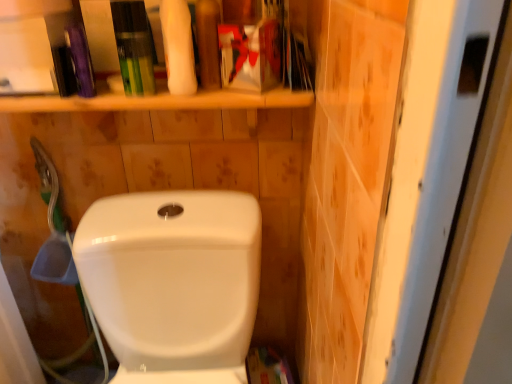
Question: From their relative heights in the image, would you say white matte sponge at upper center is taller or shorter than green plastic tube at upper center, placed as the first toiletry when sorted from left to right?

Choices:
 (A) tall
 (B) short

Answer: (A)

Question: Is white matte sponge at upper center wider or thinner than green plastic tube at upper center, placed as the 2th toiletry when sorted from right to left?

Choices:
 (A) wide
 (B) thin

Answer: (A)

Question: Which of these objects is positioned closest to the white matte sponge at upper center?

Choices:
 (A) white glossy toilet at center
 (B) green plastic tube at upper center, placed as the 2th toiletry when sorted from right to left
 (C) matte plastic toothpaste tube at upper center, acting as the 2th toiletry starting from the left

Answer: (C)

Question: Considering the real-world distances, which object is closest to the matte plastic toothpaste tube at upper center, acting as the 2th toiletry starting from the left?

Choices:
 (A) white matte sponge at upper center
 (B) white glossy toilet at center
 (C) green plastic tube at upper center, placed as the 2th toiletry when sorted from right to left

Answer: (A)